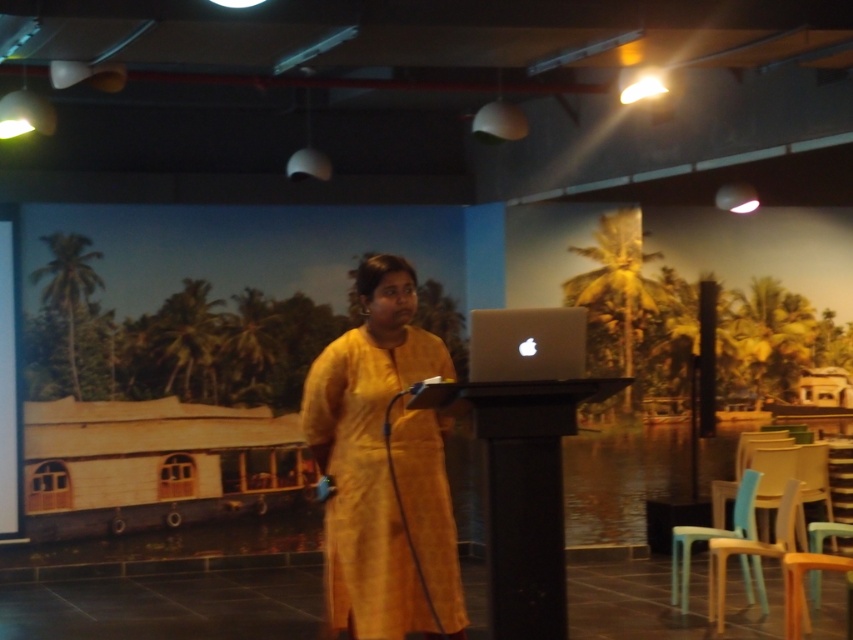
Question: Is yellow textured dress at center wider than silver metallic laptop at center?

Choices:
 (A) yes
 (B) no

Answer: (A)

Question: Is the position of yellow textured dress at center less distant than that of silver metallic laptop at center?

Choices:
 (A) no
 (B) yes

Answer: (B)

Question: Which object appears closest to the camera in this image?

Choices:
 (A) silver metallic laptop at center
 (B) yellow textured dress at center

Answer: (B)

Question: Can you confirm if yellow textured dress at center is smaller than silver metallic laptop at center?

Choices:
 (A) no
 (B) yes

Answer: (A)